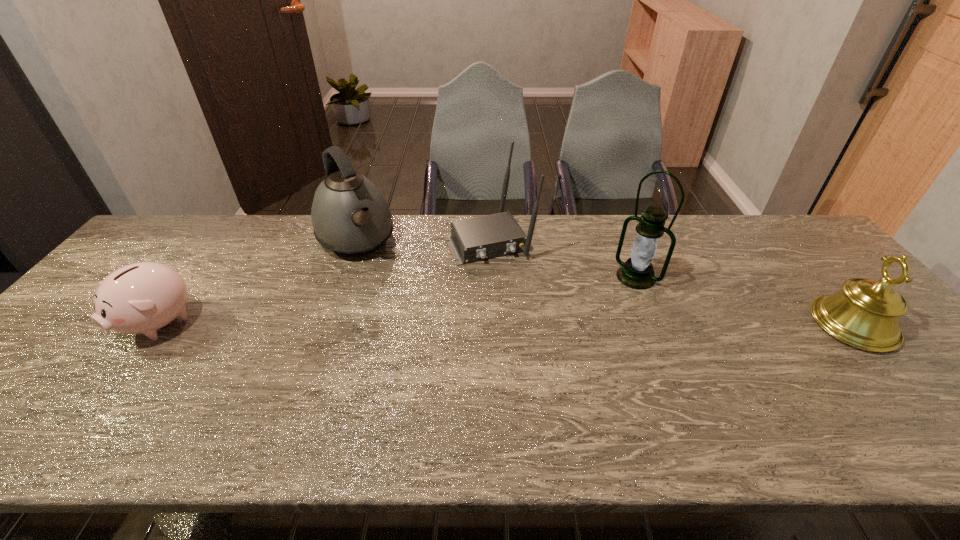
At what (x,y) coordinates should I click in order to perform the action: click on the leftmost object. Please return your answer as a coordinate pair (x, y). Looking at the image, I should click on (140, 298).

Where is `piggy bank`? The image size is (960, 540). piggy bank is located at coordinates (140, 298).

Where is `bell`? This screenshot has height=540, width=960. bell is located at coordinates pyautogui.click(x=865, y=314).

Find the location of `the rightmost object`. the rightmost object is located at coordinates pyautogui.click(x=865, y=314).

I want to click on the second object from right to left, so click(x=637, y=272).

The width and height of the screenshot is (960, 540). Identify the location of the third object from left to right. (474, 239).

Image resolution: width=960 pixels, height=540 pixels. I want to click on the fourth object from right to left, so click(x=350, y=216).

The height and width of the screenshot is (540, 960). In order to click on vacant area located 0.080m on the back of the shortest object in this screenshot , I will do `click(194, 276)`.

Locate an element on the screen. Image resolution: width=960 pixels, height=540 pixels. vacant space located on the front of the bell is located at coordinates (917, 399).

The width and height of the screenshot is (960, 540). Find the location of `free space located on the side where the fourth object from left to right emits light`. free space located on the side where the fourth object from left to right emits light is located at coordinates (598, 314).